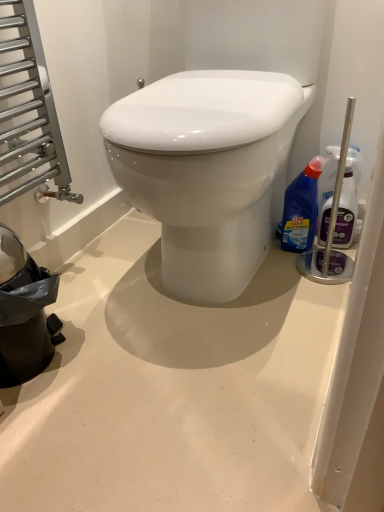
You are a GUI agent. You are given a task and a screenshot of the screen. Output one action in this format:
    pyautogui.click(x=<x>, y=<y>)
    Task: Click on the vacant region to the left of blue plastic bottle at right, which appears as the 2th bottle when viewed from the right
    This screenshot has width=384, height=512.
    Given the screenshot: What is the action you would take?
    pyautogui.click(x=271, y=257)